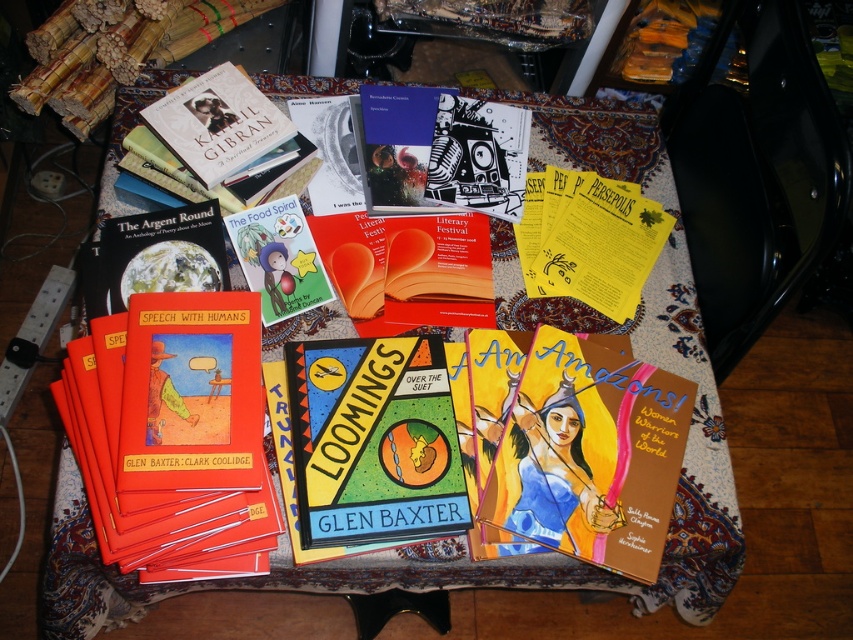
Question: Where is red matte book at lower left located in relation to hardcover book at center in the image?

Choices:
 (A) left
 (B) right

Answer: (A)

Question: Does red matte book at lower left have a lesser width compared to matte paper book at center?

Choices:
 (A) yes
 (B) no

Answer: (B)

Question: Among these points, which one is nearest to the camera?

Choices:
 (A) (698, 410)
 (B) (138, 324)
 (C) (432, 301)
 (D) (253, 408)

Answer: (D)

Question: Observing the image, what is the correct spatial positioning of matte yellow book at center in reference to matte paper book at center?

Choices:
 (A) below
 (B) above

Answer: (A)

Question: Among these points, which one is farthest from the camera?

Choices:
 (A) (125, 216)
 (B) (659, 556)

Answer: (A)

Question: Estimate the real-world distances between objects in this image. Which object is farther from the matte yellow book at center?

Choices:
 (A) matte black book at upper left
 (B) red matte book at lower left
 (C) wooden table at center
 (D) matte paper book at center

Answer: (A)